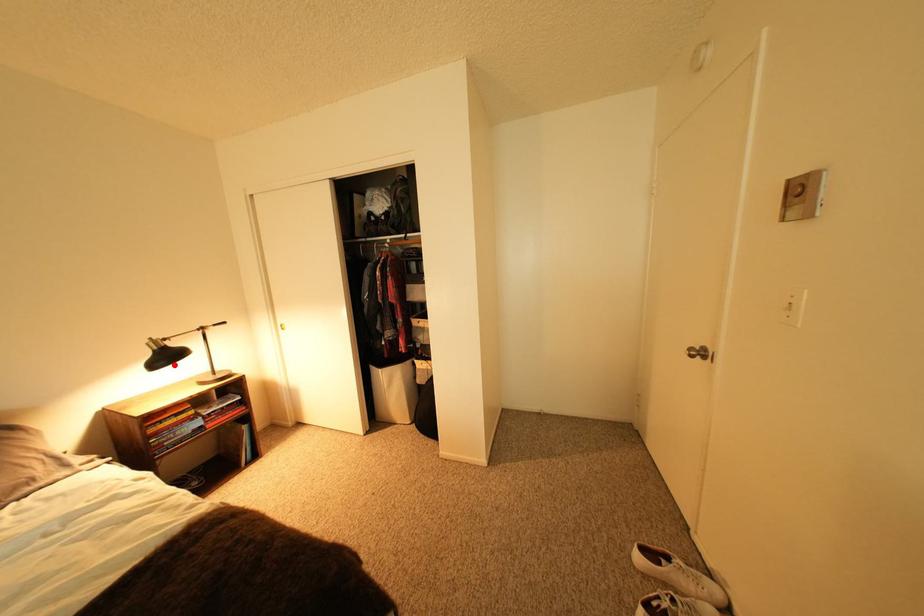
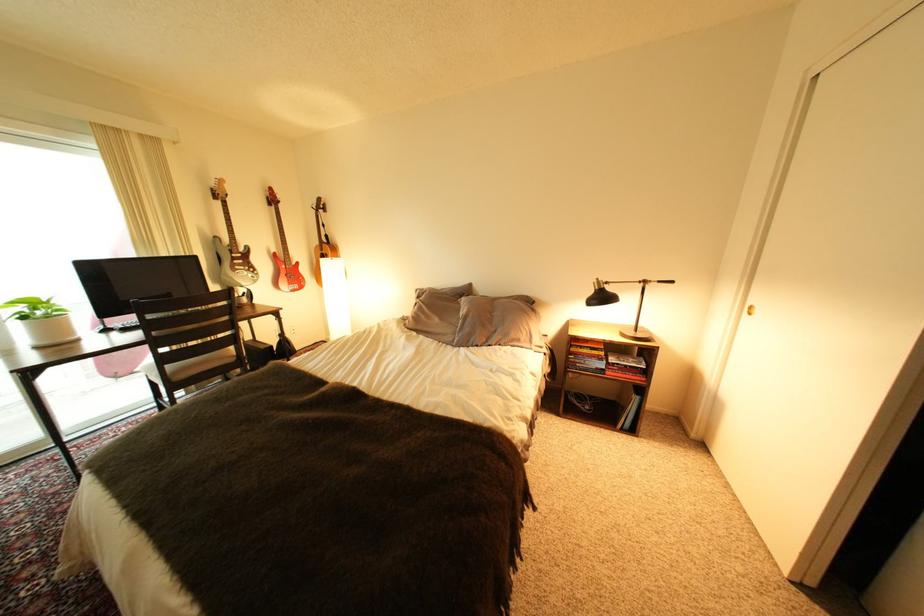
Question: I am providing you with two images of the same scene from different viewpoints. A red point is shown in image1. For the corresponding object point in image2, is it positioned nearer or farther from the camera?

Choices:
 (A) Nearer
 (B) Farther

Answer: (B)